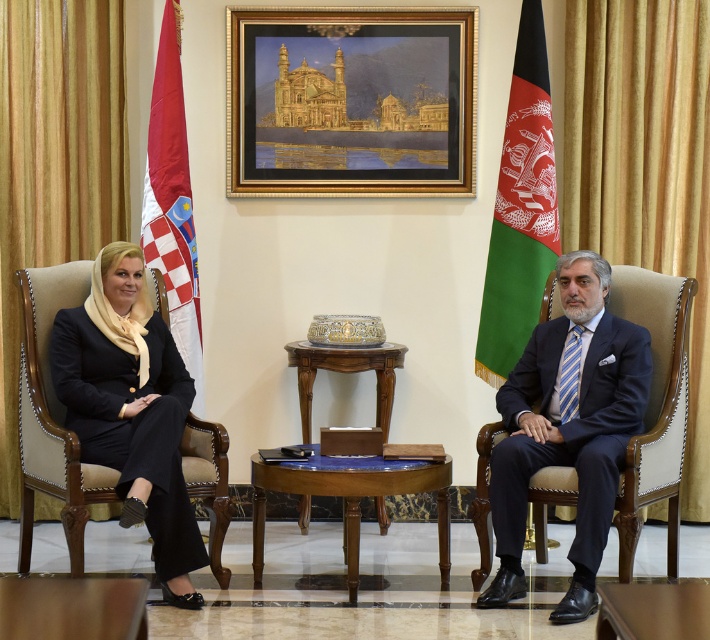
Is black satin suit at left to the right of dark wood chair at right from the viewer's perspective?

No, black satin suit at left is not to the right of dark wood chair at right.

Between black satin suit at left and dark wood chair at right, which one is positioned higher?

dark wood chair at right is above.

Identify the location of black satin suit at left. (131, 408).

What are the coordinates of `black satin suit at left` in the screenshot? It's located at (131, 408).

Which is in front, point (297, 36) or point (125, 632)?

Point (125, 632) is more forward.

Does gold-framed painting at upper center have a greater height compared to wooden polished table at center?

Indeed, gold-framed painting at upper center has a greater height compared to wooden polished table at center.

Find the location of `gold-framed painting at upper center`. gold-framed painting at upper center is located at coordinates (349, 100).

Does black satin suit at left appear on the right side of green fabric flag at right?

Incorrect, black satin suit at left is not on the right side of green fabric flag at right.

Does black satin suit at left lie in front of green fabric flag at right?

That is True.

Who is more distant from viewer, (x=200, y=602) or (x=515, y=282)?

The point (x=515, y=282) is behind.

Find the location of a particular element. black satin suit at left is located at coordinates (131, 408).